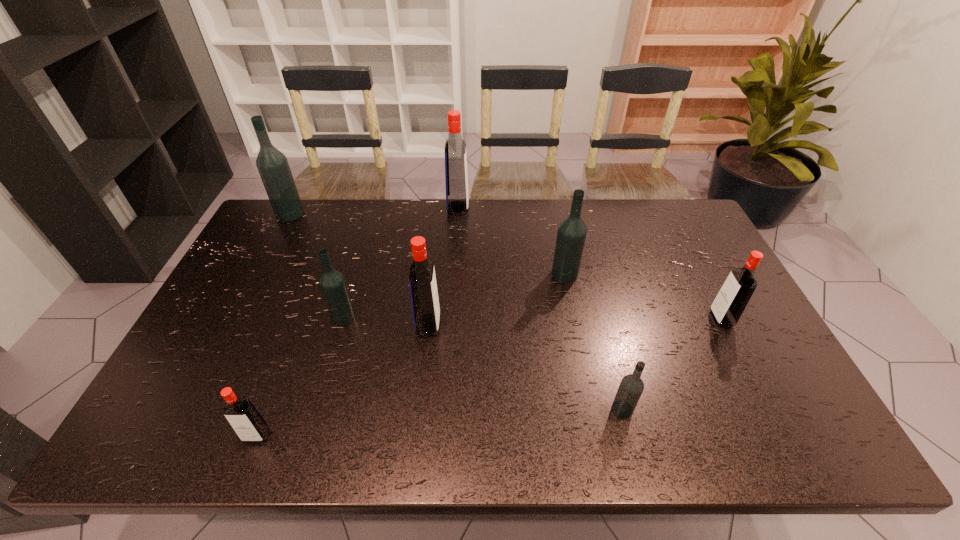
At what (x,y) coordinates should I click in order to perform the action: click on the second vodka from right to left. Please return your answer as a coordinate pair (x, y). Looking at the image, I should click on (631, 387).

You are a GUI agent. You are given a task and a screenshot of the screen. Output one action in this format:
    pyautogui.click(x=<x>, y=<y>)
    Task: Click on the smallest black vodka
    The width and height of the screenshot is (960, 540).
    Given the screenshot: What is the action you would take?
    pyautogui.click(x=631, y=387)

The width and height of the screenshot is (960, 540). I want to click on the smallest red vodka, so click(x=250, y=426).

Where is `the second object from left to right`? the second object from left to right is located at coordinates (250, 426).

Locate an element on the screen. Image resolution: width=960 pixels, height=540 pixels. vacant space positioned 0.320m on the front and back of the biggest red vodka is located at coordinates (556, 208).

You are a GUI agent. You are given a task and a screenshot of the screen. Output one action in this format:
    pyautogui.click(x=<x>, y=<y>)
    Task: Click on the vacant space located 0.110m on the front of the leftmost object
    Image resolution: width=960 pixels, height=540 pixels.
    Given the screenshot: What is the action you would take?
    pyautogui.click(x=276, y=242)

This screenshot has width=960, height=540. Identify the location of free space located 0.200m on the front and back of the third smallest red vodka. (513, 325).

The height and width of the screenshot is (540, 960). In order to click on free region located on the left of the sixth nearest object in this screenshot , I will do (x=513, y=275).

Identify the location of vacant space located 0.140m on the front and back of the rightmost vodka. (661, 319).

Find the location of `free space located on the front and back of the rightmost vodka`. free space located on the front and back of the rightmost vodka is located at coordinates (694, 319).